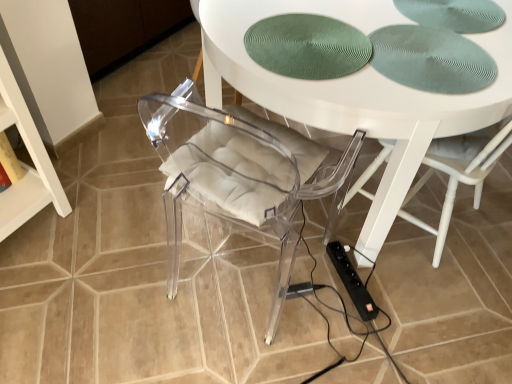
This screenshot has height=384, width=512. I want to click on vacant space behind black plastic extension cord at lower right, so click(x=345, y=243).